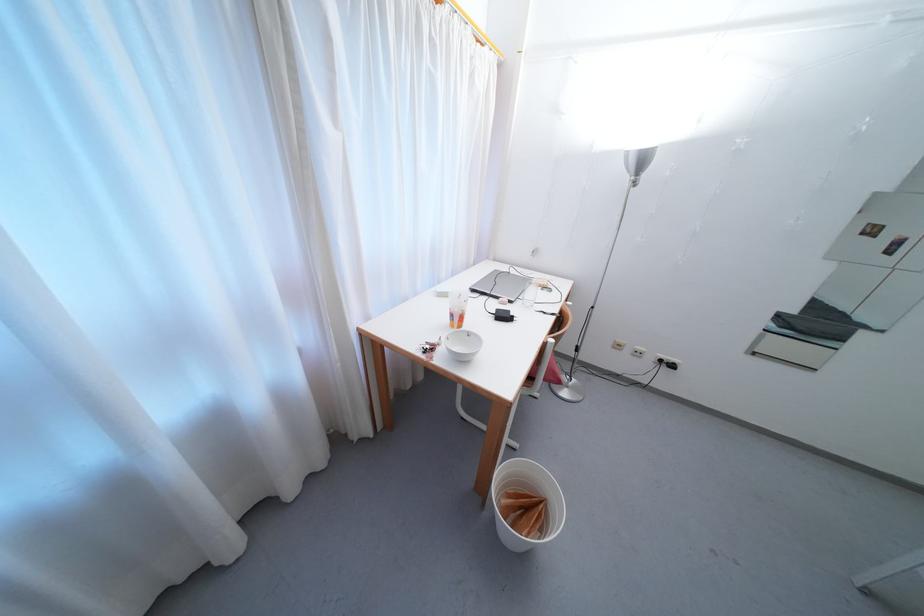
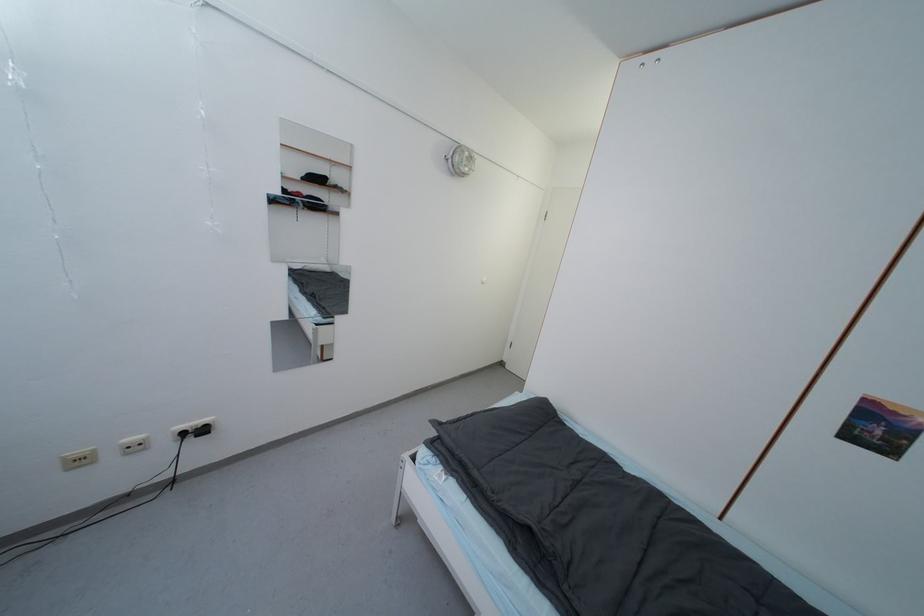
The point at (664,363) is marked in the first image. Where is the corresponding point in the second image?

(187, 436)